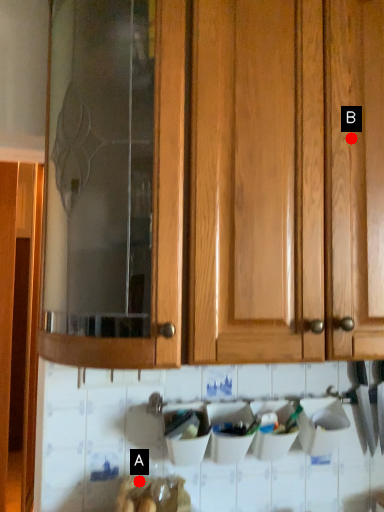
Question: Two points are circled on the image, labeled by A and B beside each circle. Which of the following is the closest to the observer?

Choices:
 (A) A is closer
 (B) B is closer

Answer: (B)